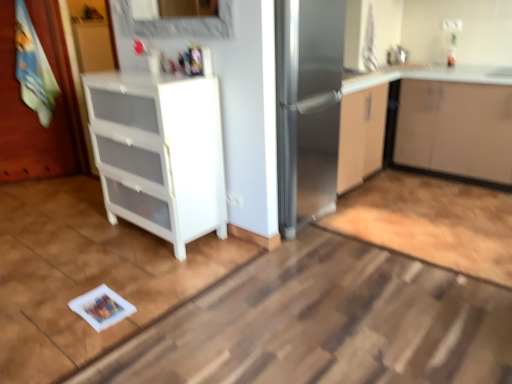
The image size is (512, 384). Describe the element at coordinates (27, 121) in the screenshot. I see `wooden painted door at left` at that location.

Identify the location of white plastic drawer unit at left, positioned as the 1th cabinetry in left-to-right order. (159, 153).

The width and height of the screenshot is (512, 384). Describe the element at coordinates (159, 153) in the screenshot. I see `white plastic drawer unit at left, the 2th cabinetry positioned from the right` at that location.

Find the location of a particular element. white plastic drawer at center is located at coordinates (325, 324).

From a real-world perspective, is wooden painted door at left physically below white plastic drawer unit at left, positioned as the 1th cabinetry in left-to-right order?

Actually, wooden painted door at left is physically above white plastic drawer unit at left, positioned as the 1th cabinetry in left-to-right order, in the real world.

Which of these two, wooden painted door at left or white plastic drawer unit at left, the 2th cabinetry positioned from the right, is wider?

white plastic drawer unit at left, the 2th cabinetry positioned from the right.

Is wooden painted door at left further to camera compared to white plastic drawer unit at left, the 2th cabinetry positioned from the right?

Yes, it is behind white plastic drawer unit at left, the 2th cabinetry positioned from the right.

Which is nearer, (52, 58) or (133, 132)?

Point (52, 58) is farther from the camera than point (133, 132).

Does point (421, 164) lie in front of point (18, 131)?

Yes, point (421, 164) is in front of point (18, 131).

Is matte white cabinet at upper right, which ranks as the second cabinetry in left-to-right order, closer to the viewer compared to wooden painted door at left?

Yes, matte white cabinet at upper right, which ranks as the second cabinetry in left-to-right order, is closer to the camera.

The width and height of the screenshot is (512, 384). What are the coordinates of `door above the matte white cabinet at upper right, which ranks as the second cabinetry in left-to-right order (from a real-world perspective)` in the screenshot? It's located at (27, 121).

Which is correct: matte white cabinet at upper right, which ranks as the second cabinetry in left-to-right order, is inside white plastic drawer unit at left, the 2th cabinetry positioned from the right, or outside of it?

matte white cabinet at upper right, which ranks as the second cabinetry in left-to-right order, cannot be found inside white plastic drawer unit at left, the 2th cabinetry positioned from the right.

Considering the relative sizes of matte white cabinet at upper right, positioned as the 1th cabinetry in right-to-left order, and white plastic drawer unit at left, the 2th cabinetry positioned from the right, in the image provided, is matte white cabinet at upper right, positioned as the 1th cabinetry in right-to-left order, shorter than white plastic drawer unit at left, the 2th cabinetry positioned from the right,?

Yes.

Is point (346, 86) in front of point (138, 112)?

No.

From the image's perspective, between matte white cabinet at upper right, positioned as the 1th cabinetry in right-to-left order, and white plastic drawer unit at left, the 2th cabinetry positioned from the right, who is located below?

white plastic drawer unit at left, the 2th cabinetry positioned from the right, is shown below in the image.

Does point (301, 103) appear closer or farther from the camera than point (37, 141)?

Point (301, 103) is closer to the camera than point (37, 141).

Does stainless steel fridge at center appear on the left side of wooden painted door at left?

No.

Does stainless steel fridge at center have a lesser width compared to wooden painted door at left?

No.

Is stainless steel fridge at center in contact with wooden painted door at left?

No, stainless steel fridge at center is not touching wooden painted door at left.

Which is behind, point (408, 69) or point (376, 284)?

The point (408, 69) is farther.

From the image's perspective, between matte white cabinet at upper right, positioned as the 1th cabinetry in right-to-left order, and white plastic drawer at center, who is located below?

white plastic drawer at center is shown below in the image.

I want to click on the 2nd cabinetry behind the white plastic drawer at center, counting from the anchor's position, so click(x=428, y=76).

In the scene shown: Is matte white cabinet at upper right, positioned as the 1th cabinetry in right-to-left order, positioned far away from white plastic drawer at center?

That's right, there is a large distance between matte white cabinet at upper right, positioned as the 1th cabinetry in right-to-left order, and white plastic drawer at center.

Considering the sizes of objects stainless steel fridge at center and white plastic drawer unit at left, positioned as the 1th cabinetry in left-to-right order, in the image provided, who is shorter, stainless steel fridge at center or white plastic drawer unit at left, positioned as the 1th cabinetry in left-to-right order,?

white plastic drawer unit at left, positioned as the 1th cabinetry in left-to-right order.

Which is behind, stainless steel fridge at center or white plastic drawer unit at left, positioned as the 1th cabinetry in left-to-right order?

stainless steel fridge at center.

Is the surface of stainless steel fridge at center in direct contact with white plastic drawer unit at left, positioned as the 1th cabinetry in left-to-right order?

stainless steel fridge at center is not next to white plastic drawer unit at left, positioned as the 1th cabinetry in left-to-right order, and they're not touching.

From the image's perspective, is stainless steel fridge at center located beneath white plastic drawer unit at left, the 2th cabinetry positioned from the right?

No, from the image's perspective, stainless steel fridge at center is not below white plastic drawer unit at left, the 2th cabinetry positioned from the right.

What's the angular difference between wooden painted door at left and matte white cabinet at upper right, positioned as the 1th cabinetry in right-to-left order,'s facing directions?

The angle between the facing direction of wooden painted door at left and the facing direction of matte white cabinet at upper right, positioned as the 1th cabinetry in right-to-left order, is 56.2 degrees.

Is matte white cabinet at upper right, which ranks as the second cabinetry in left-to-right order, a part of wooden painted door at left?

Definitely not — matte white cabinet at upper right, which ranks as the second cabinetry in left-to-right order, is not inside wooden painted door at left.

Is wooden painted door at left positioned with its back to matte white cabinet at upper right, which ranks as the second cabinetry in left-to-right order?

wooden painted door at left does not have its back to matte white cabinet at upper right, which ranks as the second cabinetry in left-to-right order.

Find the location of `the 1st cabinetry directly beneath the wooden painted door at left (from a real-world perspective)`. the 1st cabinetry directly beneath the wooden painted door at left (from a real-world perspective) is located at coordinates (159, 153).

You are a GUI agent. You are given a task and a screenshot of the screen. Output one action in this format:
    pyautogui.click(x=<x>, y=<y>)
    Task: Click on the door behind the matte white cabinet at upper right, which ranks as the second cabinetry in left-to-right order
    The image size is (512, 384).
    Given the screenshot: What is the action you would take?
    pyautogui.click(x=27, y=121)

Considering their positions, is stainless steel fridge at center positioned closer to white plastic drawer at center than white plastic drawer unit at left, positioned as the 1th cabinetry in left-to-right order?

Based on the image, white plastic drawer unit at left, positioned as the 1th cabinetry in left-to-right order, appears to be nearer to white plastic drawer at center.

Estimate the real-world distances between objects in this image. Which object is closer to wooden painted door at left, white plastic drawer at center or matte white cabinet at upper right, positioned as the 1th cabinetry in right-to-left order?

white plastic drawer at center.

Looking at the image, which one is located further to matte white cabinet at upper right, positioned as the 1th cabinetry in right-to-left order, stainless steel fridge at center or wooden painted door at left?

wooden painted door at left is positioned further to the anchor matte white cabinet at upper right, positioned as the 1th cabinetry in right-to-left order.

Considering their positions, is white plastic drawer at center positioned further to white plastic drawer unit at left, positioned as the 1th cabinetry in left-to-right order, than matte white cabinet at upper right, which ranks as the second cabinetry in left-to-right order?

matte white cabinet at upper right, which ranks as the second cabinetry in left-to-right order.

When comparing their distances from wooden painted door at left, does white plastic drawer unit at left, the 2th cabinetry positioned from the right, or white plastic drawer at center seem further?

Based on the image, white plastic drawer at center appears to be further to wooden painted door at left.

When comparing their distances from white plastic drawer unit at left, the 2th cabinetry positioned from the right, does white plastic drawer at center or wooden painted door at left seem further?

wooden painted door at left lies further to white plastic drawer unit at left, the 2th cabinetry positioned from the right, than the other object.

Considering their positions, is white plastic drawer unit at left, positioned as the 1th cabinetry in left-to-right order, positioned further to white plastic drawer at center than stainless steel fridge at center?

stainless steel fridge at center.

From the image, which object appears to be farther from white plastic drawer at center, matte white cabinet at upper right, positioned as the 1th cabinetry in right-to-left order, or stainless steel fridge at center?

matte white cabinet at upper right, positioned as the 1th cabinetry in right-to-left order, is positioned further to the anchor white plastic drawer at center.

The image size is (512, 384). I want to click on cabinetry between wooden painted door at left and stainless steel fridge at center, so point(159,153).

Identify the location of cabinetry between wooden painted door at left and matte white cabinet at upper right, which ranks as the second cabinetry in left-to-right order. (159, 153).

Where is `plain located between white plastic drawer unit at left, positioned as the 1th cabinetry in left-to-right order, and matte white cabinet at upper right, which ranks as the second cabinetry in left-to-right order, in the left-right direction`? plain located between white plastic drawer unit at left, positioned as the 1th cabinetry in left-to-right order, and matte white cabinet at upper right, which ranks as the second cabinetry in left-to-right order, in the left-right direction is located at coordinates (325, 324).

Find the location of `fridge situated between wooden painted door at left and white plastic drawer at center from left to right`. fridge situated between wooden painted door at left and white plastic drawer at center from left to right is located at coordinates 305,89.